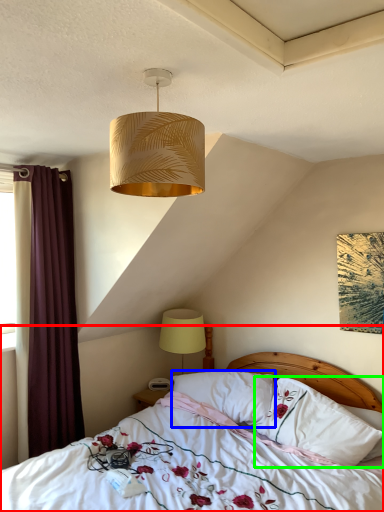
Question: Based on their relative distances, which object is nearer to bed (highlighted by a red box)? Choose from pillow (highlighted by a blue box) and pillow (highlighted by a green box).

Choices:
 (A) pillow
 (B) pillow

Answer: (B)